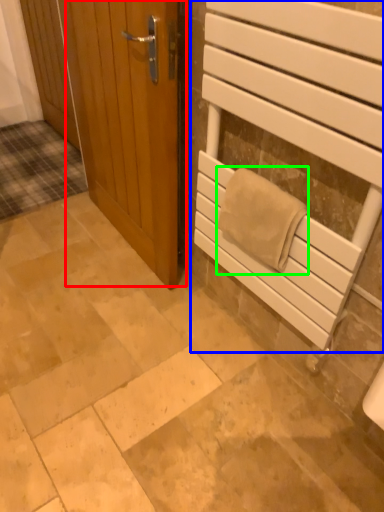
Question: Which is farther away from door (highlighted by a red box)? elevator (highlighted by a blue box) or bath towel (highlighted by a green box)?

Choices:
 (A) elevator
 (B) bath towel

Answer: (B)